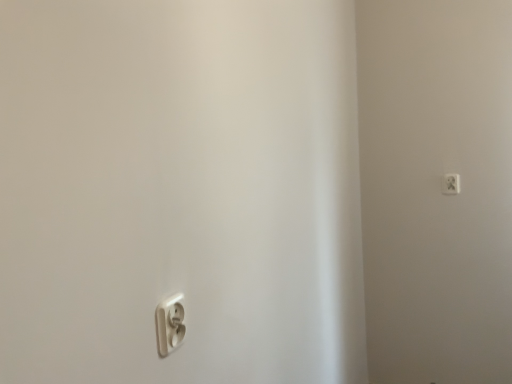
Question: Can you confirm if white plastic power plug at upper right, the 1th power plugs and sockets when ordered from back to front, is wider than white plastic power plug at lower left, marked as the second power plugs and sockets in a right-to-left arrangement?

Choices:
 (A) no
 (B) yes

Answer: (A)

Question: Can you confirm if white plastic power plug at upper right, acting as the 2th power plugs and sockets starting from the bottom, is thinner than white plastic power plug at lower left, which is counted as the first power plugs and sockets, starting from the bottom?

Choices:
 (A) no
 (B) yes

Answer: (B)

Question: Is white plastic power plug at upper right, placed as the second power plugs and sockets when sorted from front to back, positioned far away from white plastic power plug at lower left, the 1th power plugs and sockets from the front?

Choices:
 (A) no
 (B) yes

Answer: (B)

Question: Does white plastic power plug at upper right, placed as the second power plugs and sockets when sorted from front to back, have a smaller size compared to white plastic power plug at lower left, the 1th power plugs and sockets from the front?

Choices:
 (A) no
 (B) yes

Answer: (B)

Question: From the image's perspective, would you say white plastic power plug at upper right, acting as the 1th power plugs and sockets starting from the top, is positioned over white plastic power plug at lower left, the 1th power plugs and sockets from the front?

Choices:
 (A) no
 (B) yes

Answer: (B)

Question: Considering the relative sizes of white plastic power plug at upper right, placed as the second power plugs and sockets when sorted from front to back, and white plastic power plug at lower left, which is the 1th power plugs and sockets from left to right, in the image provided, is white plastic power plug at upper right, placed as the second power plugs and sockets when sorted from front to back, bigger than white plastic power plug at lower left, which is the 1th power plugs and sockets from left to right,?

Choices:
 (A) no
 (B) yes

Answer: (A)

Question: Is white plastic power plug at lower left, the 2th power plugs and sockets in the top-to-bottom sequence, located outside white plastic power plug at upper right, which is counted as the first power plugs and sockets, starting from the right?

Choices:
 (A) no
 (B) yes

Answer: (B)

Question: From the image's perspective, does white plastic power plug at lower left, the 2th power plugs and sockets in the top-to-bottom sequence, appear higher than white plastic power plug at upper right, acting as the 2th power plugs and sockets starting from the bottom?

Choices:
 (A) no
 (B) yes

Answer: (A)

Question: Is white plastic power plug at lower left, marked as the 2th power plugs and sockets in a back-to-front arrangement, facing towards white plastic power plug at upper right, placed as the second power plugs and sockets when sorted from front to back?

Choices:
 (A) yes
 (B) no

Answer: (B)

Question: From a real-world perspective, is white plastic power plug at lower left, the 2th power plugs and sockets in the top-to-bottom sequence, located beneath white plastic power plug at upper right, acting as the 1th power plugs and sockets starting from the top?

Choices:
 (A) yes
 (B) no

Answer: (A)

Question: From the image's perspective, is white plastic power plug at lower left, the 2th power plugs and sockets in the top-to-bottom sequence, beneath white plastic power plug at upper right, placed as the second power plugs and sockets when sorted from front to back?

Choices:
 (A) yes
 (B) no

Answer: (A)

Question: Can you confirm if white plastic power plug at lower left, marked as the 2th power plugs and sockets in a back-to-front arrangement, is shorter than white plastic power plug at upper right, which is counted as the 2th power plugs and sockets, starting from the left?

Choices:
 (A) yes
 (B) no

Answer: (A)

Question: Is white plastic power plug at upper right, acting as the 2th power plugs and sockets starting from the bottom, inside the boundaries of white plastic power plug at lower left, marked as the second power plugs and sockets in a right-to-left arrangement, or outside?

Choices:
 (A) outside
 (B) inside

Answer: (A)